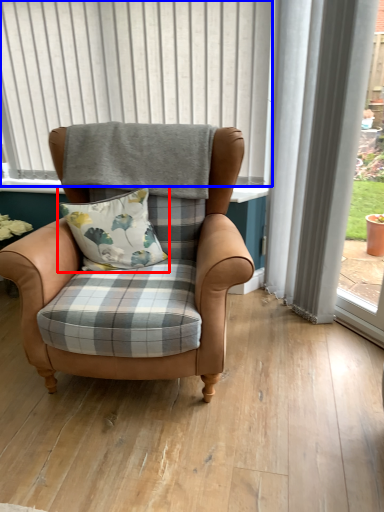
Question: Among these objects, which one is farthest to the camera, pillow (highlighted by a red box) or bay window (highlighted by a blue box)?

Choices:
 (A) pillow
 (B) bay window

Answer: (B)